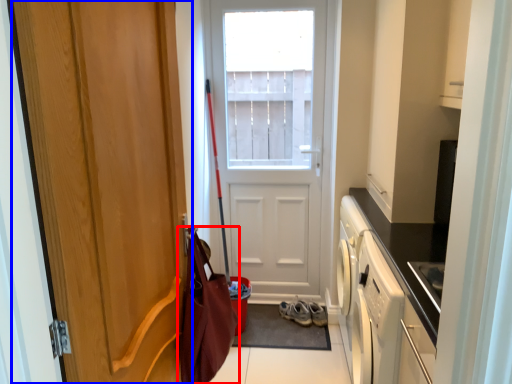
Question: Which of the following is the closest to the observer, messenger bag (highlighted by a red box) or door (highlighted by a blue box)?

Choices:
 (A) messenger bag
 (B) door

Answer: (B)